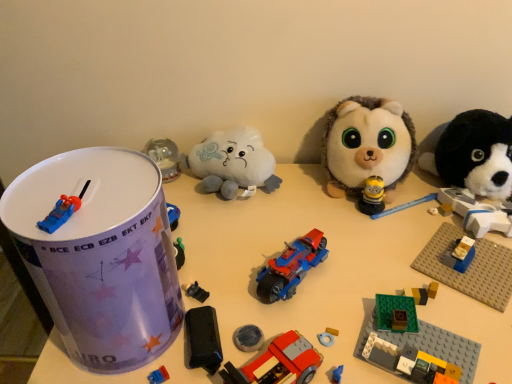
In order to click on vacant space behind blue plastic car at top left, marked as the 1th toy in a left-to-right arrangement in this screenshot , I will do `click(86, 175)`.